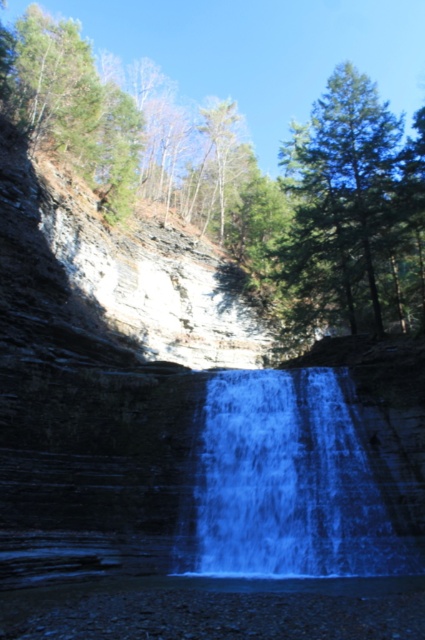
You are a photographer standing at the base of the waterfall. You want to capture a photo that includes both the point at coordinates point [365,257] and point [402,204]. Which point is closer to your camera lens?

Point [402,204] is closer to the camera lens because it is less further than point [365,257], which is positioned further away from the camera.

You are standing at the base of the waterfall and want to reach the point marked at coordinates (x=260, y=477). Given that the path is 23.14 meters long, is this a short walk or a long hike?

The point marked at coordinates (x=260, y=477) is 23.14 meters away from your current position. Since 23 meters is a moderate distance, it would be considered a short hike rather than a quick walk.